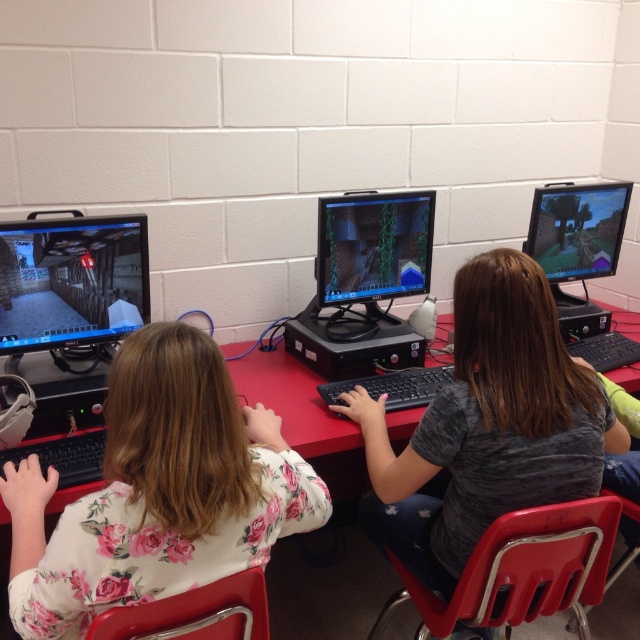
Can you confirm if red plastic table at center is positioned above matte black monitor at right?

Incorrect, red plastic table at center is not positioned above matte black monitor at right.

Measure the distance between point (330, 433) and camera.

A distance of 1.66 meters exists between point (330, 433) and camera.

At what (x,y) coordinates should I click in order to perform the action: click on red plastic table at center. Please return your answer as a coordinate pair (x, y). The width and height of the screenshot is (640, 640). Looking at the image, I should click on (305, 417).

Can you confirm if matte black monitor at left is positioned below matte black monitor at right?

Correct, matte black monitor at left is located below matte black monitor at right.

Image resolution: width=640 pixels, height=640 pixels. Describe the element at coordinates (72, 282) in the screenshot. I see `matte black monitor at left` at that location.

Does point (113, 308) come closer to viewer compared to point (586, 209)?

That is True.

Find the location of a particular element. The image size is (640, 640). matte black monitor at left is located at coordinates (72, 282).

Can you confirm if floral shirt at center is wider than matte black monitor at right?

Yes, floral shirt at center is wider than matte black monitor at right.

Does point (163, 364) come in front of point (554, 268)?

Yes, it is in front of point (554, 268).

I want to click on floral shirt at center, so click(157, 492).